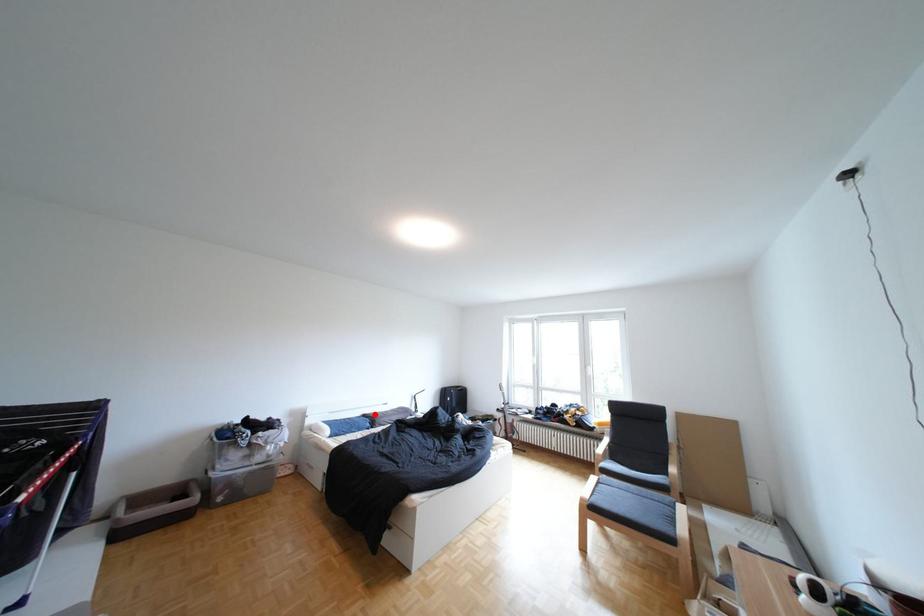
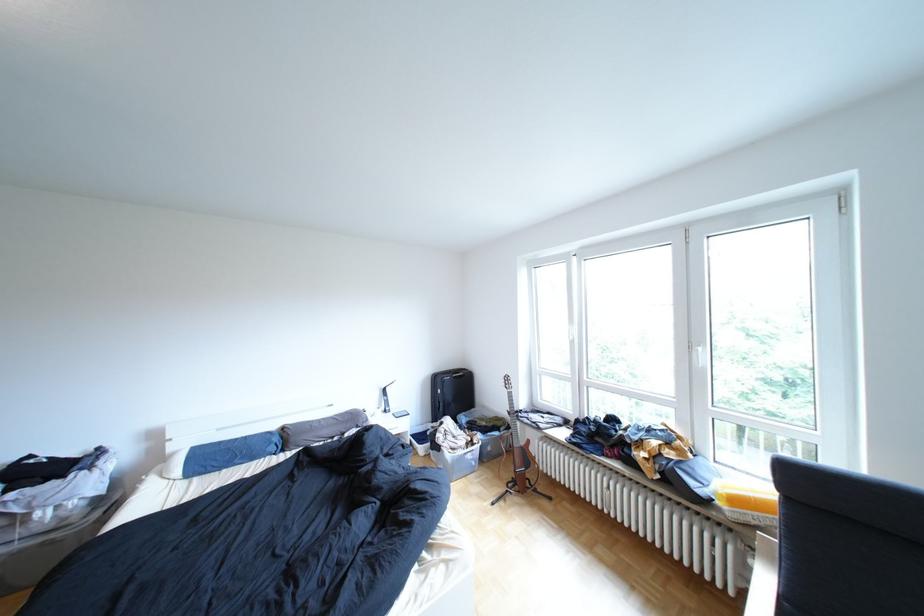
Locate, in the second image, the point that corresponds to the highlighted location in the first image.

(289, 427)